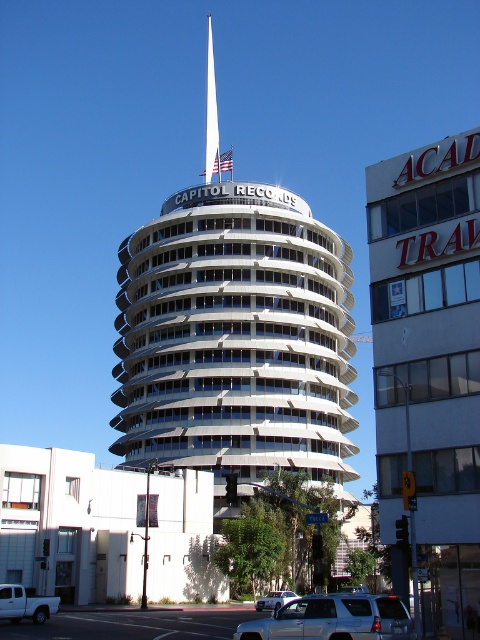
Question: Which point is closer to the camera?

Choices:
 (A) silver metallic suv at center
 (B) white matte truck at lower left

Answer: (B)

Question: Does white glossy spire at center have a greater width compared to silver metallic suv at center?

Choices:
 (A) yes
 (B) no

Answer: (A)

Question: Does white matte truck at lower left lie behind silver metallic suv at center?

Choices:
 (A) no
 (B) yes

Answer: (A)

Question: Which of the following is the farthest from the observer?

Choices:
 (A) silver metallic suv at center
 (B) white matte truck at lower left
 (C) silver metallic suv at lower center
 (D) white glossy spire at center

Answer: (D)

Question: Which point is farther to the camera?

Choices:
 (A) white glossy spire at center
 (B) silver metallic suv at center
 (C) white matte truck at lower left

Answer: (A)

Question: Can you confirm if white matte truck at lower left is positioned above silver metallic suv at center?

Choices:
 (A) no
 (B) yes

Answer: (B)